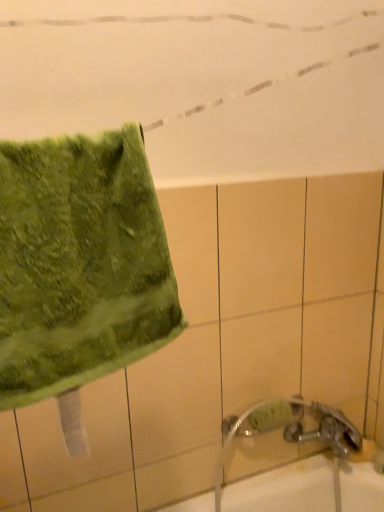
What is the approximate width of green fuzzy towel at left?

3.80 inches.

At what (x,y) coordinates should I click in order to perform the action: click on green fuzzy towel at left. Please return your answer as a coordinate pair (x, y). The width and height of the screenshot is (384, 512). Looking at the image, I should click on (80, 264).

In order to face green fuzzy towel at left, should I rotate leftwards or rightwards?

Turn left by 13.922 degrees to look at green fuzzy towel at left.

The height and width of the screenshot is (512, 384). Describe the element at coordinates (80, 264) in the screenshot. I see `green fuzzy towel at left` at that location.

Measure the distance between point (82, 328) and camera.

Point (82, 328) is 21.06 inches away from camera.

What is the approximate width of silver metallic faucet at lower right?

It is 7.01 inches.

This screenshot has height=512, width=384. In order to click on silver metallic faucet at lower right in this screenshot , I will do `click(290, 431)`.

What do you see at coordinates (290, 431) in the screenshot? I see `silver metallic faucet at lower right` at bounding box center [290, 431].

Identify the location of green fuzzy towel at left. Image resolution: width=384 pixels, height=512 pixels. (80, 264).

Which is more to the right, silver metallic faucet at lower right or green fuzzy towel at left?

silver metallic faucet at lower right is more to the right.

Is silver metallic faucet at lower right in front of green fuzzy towel at left?

No.

Which is less distant, (310, 408) or (87, 288)?

Point (310, 408) appears to be farther away from the viewer than point (87, 288).

From the picture: From the image's perspective, which is below, silver metallic faucet at lower right or green fuzzy towel at left?

silver metallic faucet at lower right appears lower in the image.

From a real-world perspective, does silver metallic faucet at lower right sit lower than green fuzzy towel at left?

Yes, from a real-world perspective, silver metallic faucet at lower right is below green fuzzy towel at left.

Which of these two, silver metallic faucet at lower right or green fuzzy towel at left, is wider?

With larger width is silver metallic faucet at lower right.

Is silver metallic faucet at lower right shorter than green fuzzy towel at left?

No.

Who is smaller, silver metallic faucet at lower right or green fuzzy towel at left?

With smaller size is green fuzzy towel at left.

Is silver metallic faucet at lower right not inside green fuzzy towel at left?

Yes.

Looking at this image, is silver metallic faucet at lower right not close to green fuzzy towel at left?

No, silver metallic faucet at lower right is not far from green fuzzy towel at left.

Is silver metallic faucet at lower right oriented towards green fuzzy towel at left?

No, silver metallic faucet at lower right is not turned towards green fuzzy towel at left.

Identify the location of towel in front of the silver metallic faucet at lower right. (80, 264).

Which is more to the left, green fuzzy towel at left or silver metallic faucet at lower right?

green fuzzy towel at left is more to the left.

Is green fuzzy towel at left positioned behind silver metallic faucet at lower right?

No, it is not.

Which is closer to the camera, (86, 170) or (345, 450)?

The point (86, 170) is closer to the camera.

In the scene shown: From the image's perspective, is green fuzzy towel at left beneath silver metallic faucet at lower right?

No.

From a real-world perspective, is green fuzzy towel at left positioned under silver metallic faucet at lower right based on gravity?

No, from a real-world perspective, green fuzzy towel at left is not beneath silver metallic faucet at lower right.

Considering the sizes of objects green fuzzy towel at left and silver metallic faucet at lower right in the image provided, who is wider, green fuzzy towel at left or silver metallic faucet at lower right?

Wider between the two is silver metallic faucet at lower right.

Between green fuzzy towel at left and silver metallic faucet at lower right, which one has more height?

silver metallic faucet at lower right is taller.

Considering the sizes of objects green fuzzy towel at left and silver metallic faucet at lower right in the image provided, who is smaller, green fuzzy towel at left or silver metallic faucet at lower right?

green fuzzy towel at left is smaller.

Is green fuzzy towel at left inside or outside of silver metallic faucet at lower right?

green fuzzy towel at left is not inside silver metallic faucet at lower right, it's outside.

Is green fuzzy towel at left not close to silver metallic faucet at lower right?

No, green fuzzy towel at left is not far from silver metallic faucet at lower right.

From the picture: Could you tell me if green fuzzy towel at left is turned towards silver metallic faucet at lower right?

No, green fuzzy towel at left is not oriented towards silver metallic faucet at lower right.

Measure the distance between green fuzzy towel at left and silver metallic faucet at lower right.

green fuzzy towel at left is 31.56 inches from silver metallic faucet at lower right.

What are the coordinates of `towel on the left of the silver metallic faucet at lower right` in the screenshot? It's located at (80, 264).

In order to click on faucet located underneath the green fuzzy towel at left (from a real-world perspective) in this screenshot , I will do `click(290, 431)`.

Where is `towel that is above the silver metallic faucet at lower right (from a real-world perspective)`? towel that is above the silver metallic faucet at lower right (from a real-world perspective) is located at coordinates (80, 264).